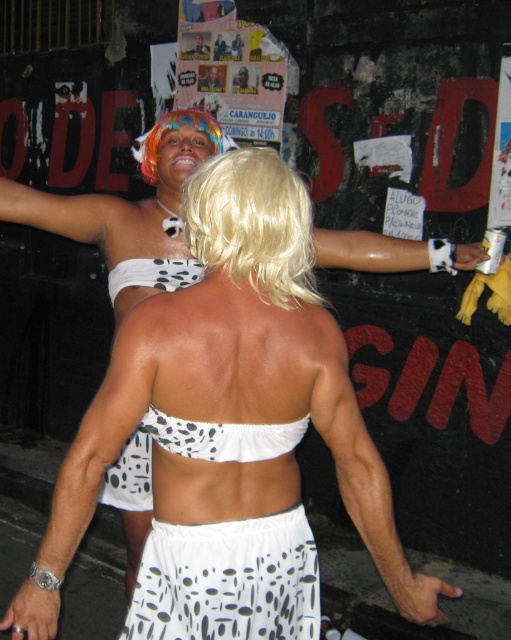
Does white dotted fabric skirt at lower center appear on the right side of white dotted fabric bikini top at center?

Incorrect, white dotted fabric skirt at lower center is not on the right side of white dotted fabric bikini top at center.

Can you confirm if white dotted fabric skirt at lower center is wider than white dotted fabric bikini top at center?

Yes.

Image resolution: width=511 pixels, height=640 pixels. What are the coordinates of `white dotted fabric skirt at lower center` in the screenshot? It's located at 227,580.

Is point (200, 428) positioned in front of point (183, 118)?

Yes, it is.

I want to click on white dotted fabric bikini top at center, so click(222, 436).

Is point (167, 284) positioned after point (145, 145)?

No, (167, 284) is closer to viewer.

Between point (141, 262) and point (157, 131), which one is positioned in front?

Point (141, 262) is more forward.

Find the location of `white dotted fabric bikini top at back`. white dotted fabric bikini top at back is located at coordinates (152, 275).